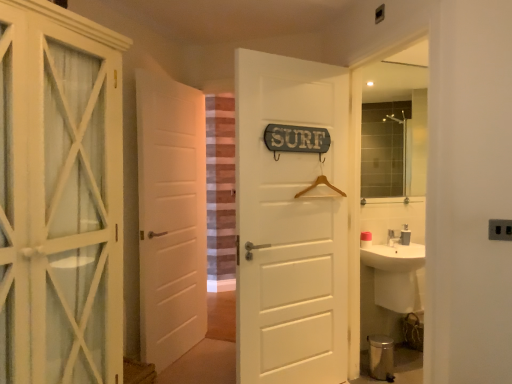
Question: From the image's perspective, is white wooden cabinet at left, the 1th door in the left-to-right sequence, positioned above or below metallic silver toilet bowl at lower right?

Choices:
 (A) above
 (B) below

Answer: (A)

Question: Does point (8, 206) appear closer or farther from the camera than point (382, 349)?

Choices:
 (A) farther
 (B) closer

Answer: (B)

Question: Which of these objects is positioned closest to the black plastic electric outlet at lower right?

Choices:
 (A) white glossy sink at right
 (B) matte glass mirror at upper right
 (C) metallic silver toilet bowl at lower right
 (D) striped fabric curtain at center
 (E) white wooden cabinet at left, the 3th door when ordered from back to front

Answer: (A)

Question: Which of these objects is positioned closest to the white wooden cabinet at left, the first door when ordered from front to back?

Choices:
 (A) white matte door at center, arranged as the third door when viewed from the left
 (B) white glossy sink at right
 (C) metallic silver toilet bowl at lower right
 (D) white matte door at center, which is the third door from front to back
 (E) striped fabric curtain at center

Answer: (A)